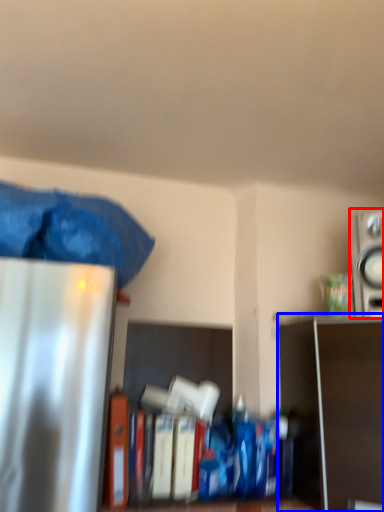
Question: Which point is closer to the camera, appliance (highlighted by a red box) or shelf (highlighted by a blue box)?

Choices:
 (A) appliance
 (B) shelf

Answer: (B)